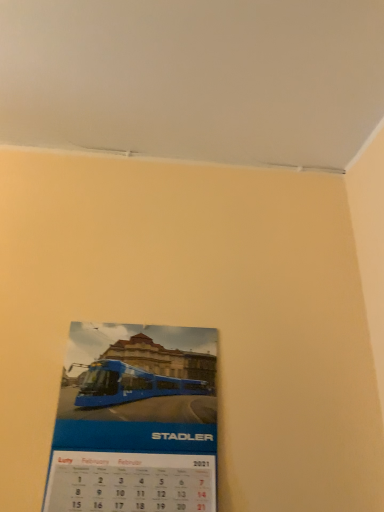
In order to face blue paper calendar at lower center, should I rotate leftwards or rightwards?

To face it directly, rotate left by 6.987 degrees.

Identify the location of blue paper calendar at lower center. The height and width of the screenshot is (512, 384). click(x=135, y=421).

Measure the distance between blue paper calendar at lower center and camera.

The depth of blue paper calendar at lower center is 28.72 inches.

This screenshot has width=384, height=512. What do you see at coordinates (135, 421) in the screenshot? I see `blue paper calendar at lower center` at bounding box center [135, 421].

The height and width of the screenshot is (512, 384). What are the coordinates of `blue paper calendar at lower center` in the screenshot? It's located at (135, 421).